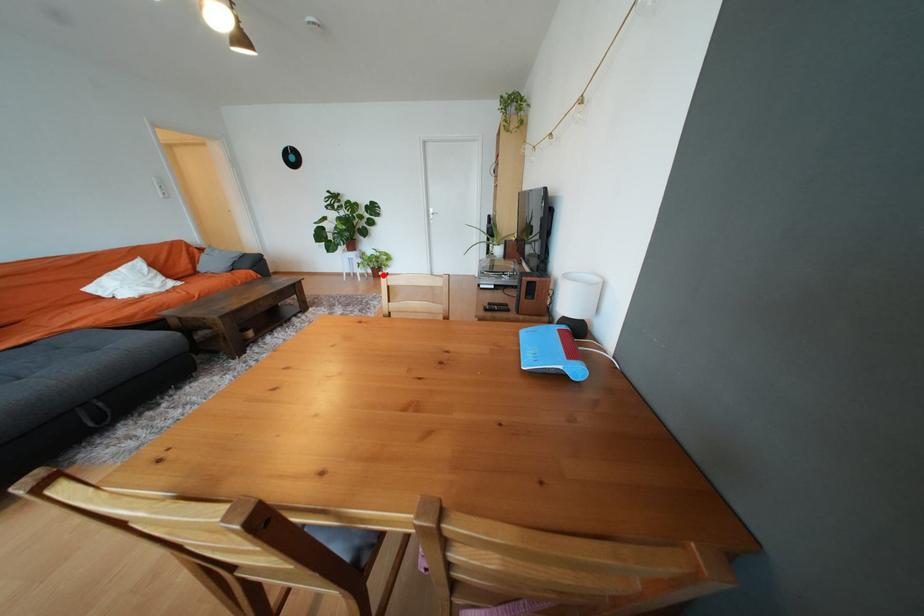
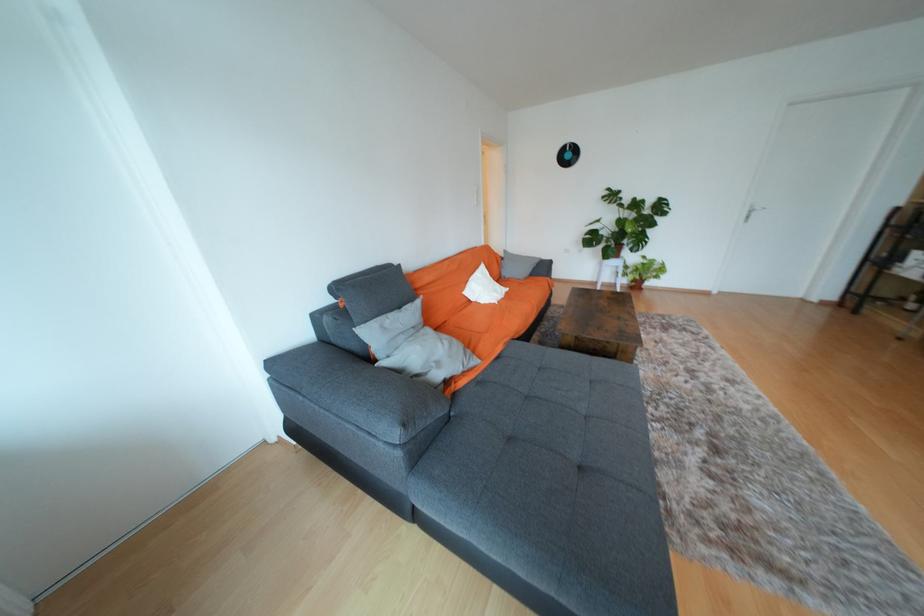
Where in the second image is the point corresponding to the highlighted location from the first image?

(641, 286)